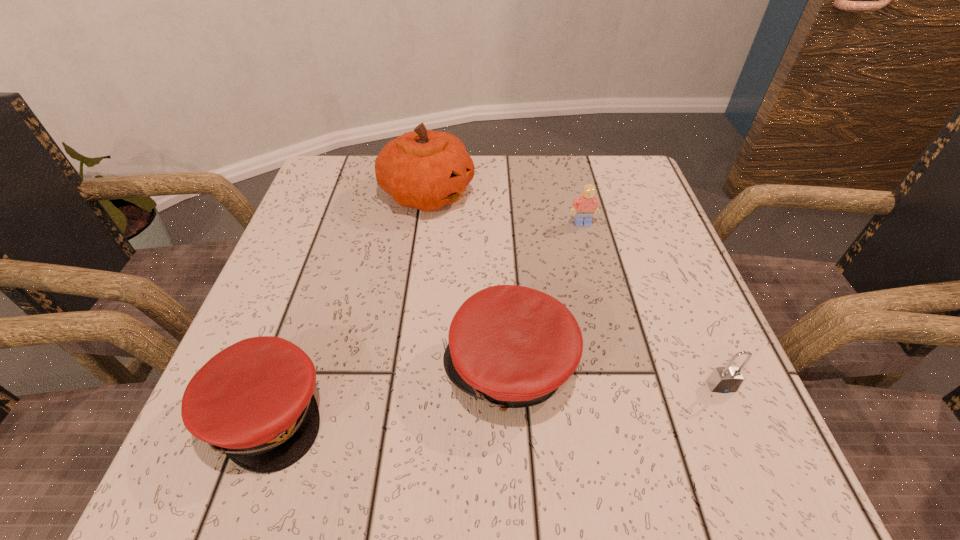
Find the location of a particular element. This screenshot has width=960, height=540. free space at the near left corner of the desktop is located at coordinates (275, 475).

The height and width of the screenshot is (540, 960). In the image, there is a desktop. Identify the location of free space at the far right corner. (618, 171).

At what (x,y) coordinates should I click in order to perform the action: click on free spot at the near right corner of the desktop. Please return your answer as a coordinate pair (x, y). This screenshot has width=960, height=540. Looking at the image, I should click on (679, 427).

The width and height of the screenshot is (960, 540). I want to click on unoccupied position between the right cap and the rightmost object, so click(x=615, y=377).

You are a GUI agent. You are given a task and a screenshot of the screen. Output one action in this format:
    pyautogui.click(x=<x>, y=<y>)
    Task: Click on the vacant space that's between the right cap and the padlock
    Image resolution: width=960 pixels, height=540 pixels.
    Given the screenshot: What is the action you would take?
    pyautogui.click(x=615, y=377)

The image size is (960, 540). Identify the location of free space between the left cap and the tallest object. (347, 303).

You are a GUI agent. You are given a task and a screenshot of the screen. Output one action in this format:
    pyautogui.click(x=<x>, y=<y>)
    Task: Click on the vacant space that's between the pumpkin and the right cap
    This screenshot has height=540, width=960.
    Given the screenshot: What is the action you would take?
    pyautogui.click(x=468, y=281)

Where is `unoccupied area between the tallest object and the left cap`? The width and height of the screenshot is (960, 540). unoccupied area between the tallest object and the left cap is located at coordinates [347, 303].

This screenshot has width=960, height=540. What are the coordinates of `free spot between the shorter cap and the pumpkin` in the screenshot? It's located at (347, 303).

I want to click on vacant area between the tallest object and the right cap, so click(468, 281).